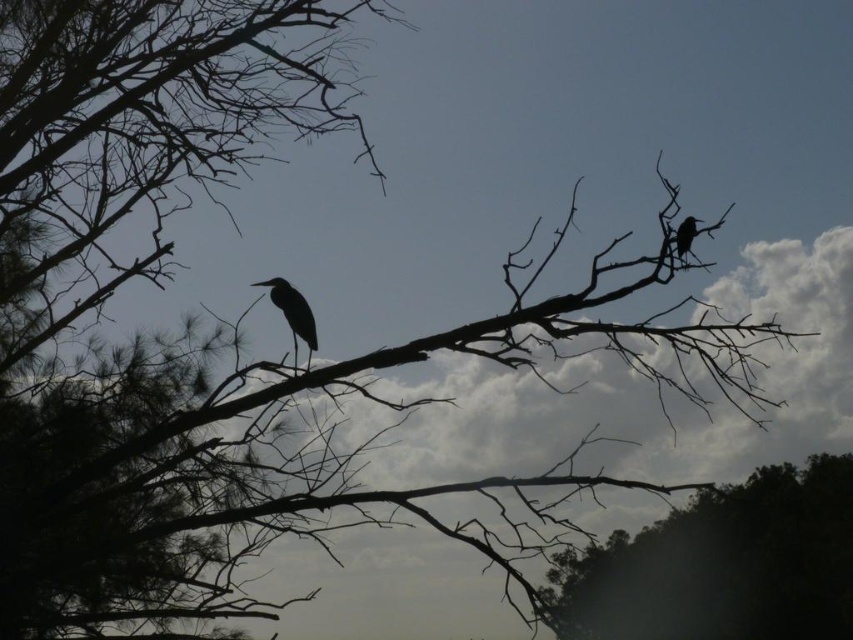
You are a birdwatcher observing the scene. You notice the dark brown bark tree at lower right and the matte black bird at upper right. Which object is positioned higher in the image?

The matte black bird at upper right is positioned higher than the dark brown bark tree at lower right.

Based on the photo, you are an ornithologist observing the scene. You notice the dark brown bark tree at lower right and the matte black bird at center. Which object is bigger in this image?

The dark brown bark tree at lower right is larger in size than the matte black bird at center.

You are standing at the center of the image and want to locate the dark brown bark tree at lower right. According to the coordinates provided, in which direction should you look to find it?

The dark brown bark tree at lower right is located at coordinates point [721,564], so you should look to the lower right direction to find it.